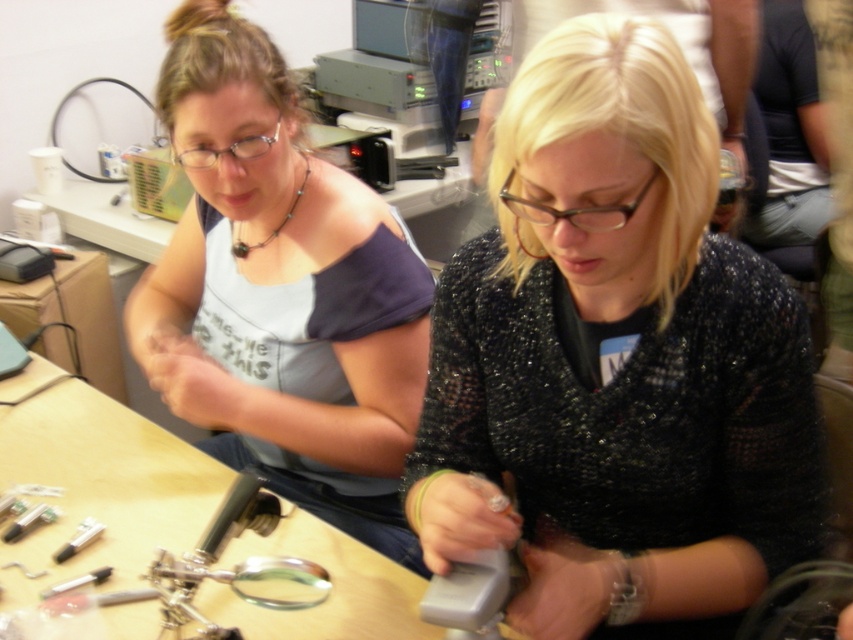
Which is behind, point (381, 342) or point (132, 561)?

Point (381, 342)

Does matte blue tank top at upper left come in front of wooden table at center?

No.

At what (x,y) coordinates should I click in order to perform the action: click on matte blue tank top at upper left. Please return your answer as a coordinate pair (x, y). This screenshot has height=640, width=853. Looking at the image, I should click on (281, 291).

What do you see at coordinates (614, 362) in the screenshot? The width and height of the screenshot is (853, 640). I see `black textured sweater at center` at bounding box center [614, 362].

Between point (567, 237) and point (85, 465), which one is positioned in front?

Point (567, 237)

This screenshot has width=853, height=640. I want to click on black textured sweater at center, so click(614, 362).

Can you confirm if black textured sweater at center is positioned above matte blue tank top at upper left?

No, black textured sweater at center is not above matte blue tank top at upper left.

From the picture: Can you confirm if black textured sweater at center is smaller than matte blue tank top at upper left?

Indeed, black textured sweater at center has a smaller size compared to matte blue tank top at upper left.

Where is `black textured sweater at center`? This screenshot has height=640, width=853. black textured sweater at center is located at coordinates (614, 362).